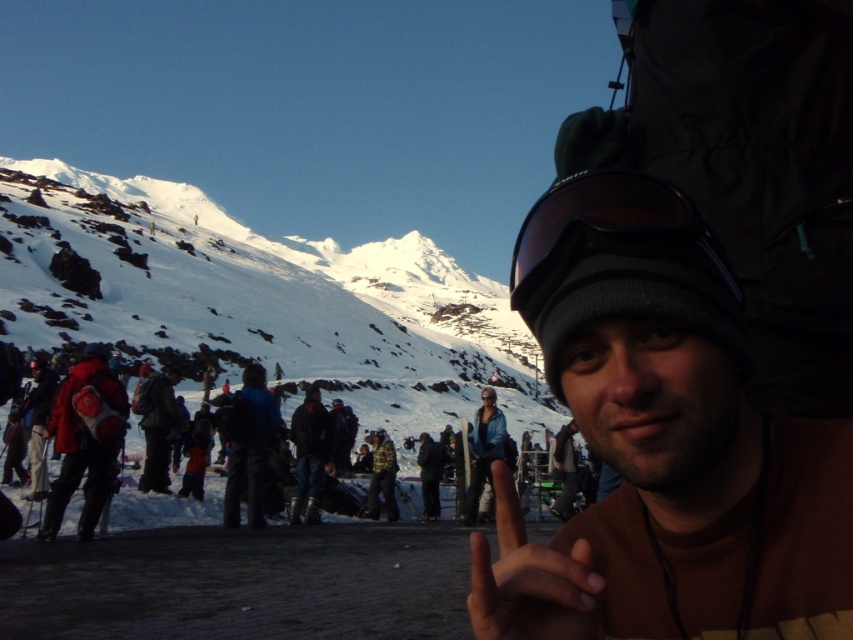
You are a photographer at the ski resort and want to capture a photo of the black matte goggles at center and the dark matte hand at center. Based on their positions, which object should appear higher in the photo?

The black matte goggles at center should appear higher in the photo because it is positioned above the dark matte hand at center.

You are a photographer trying to capture the best shot of the black matte goggles at center. The camera you are using has a very narrow field of view. Can you determine if the black matte goggles at center will be in the frame if you point the camera at point (616,237)?

Yes, the black matte goggles at center are located exactly at point (616,237), so pointing the camera at that coordinate will ensure the goggles are centered in the frame.